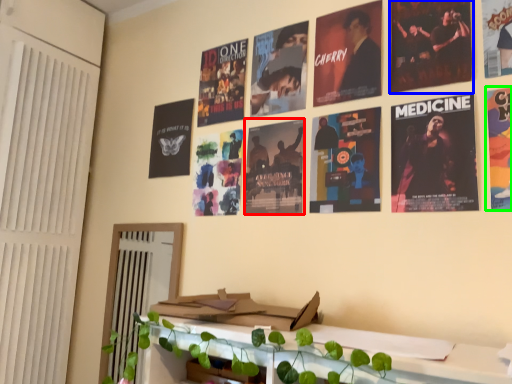
Question: Which object is positioned farthest from poster (highlighted by a red box)? Select from poster (highlighted by a blue box) and poster (highlighted by a green box).

Choices:
 (A) poster
 (B) poster

Answer: (B)